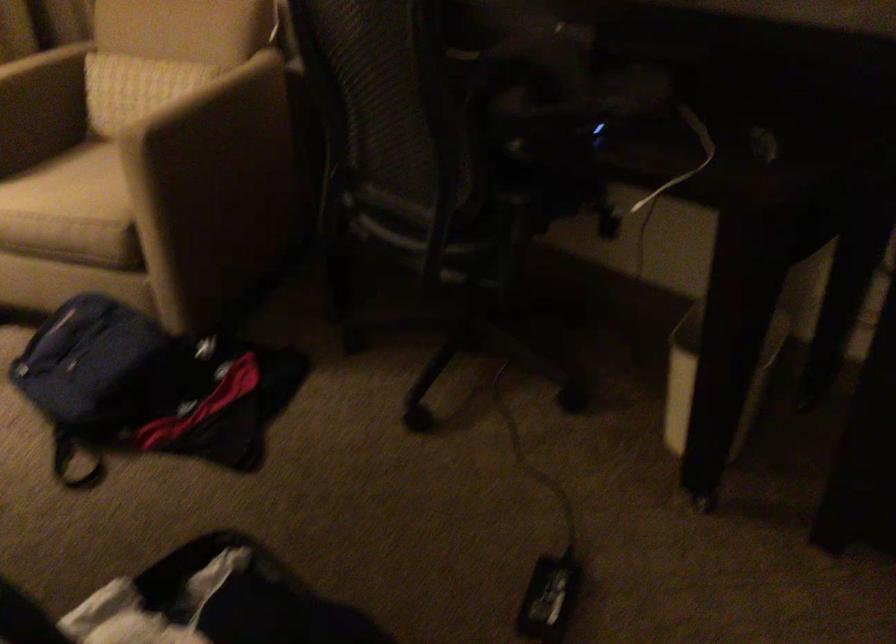
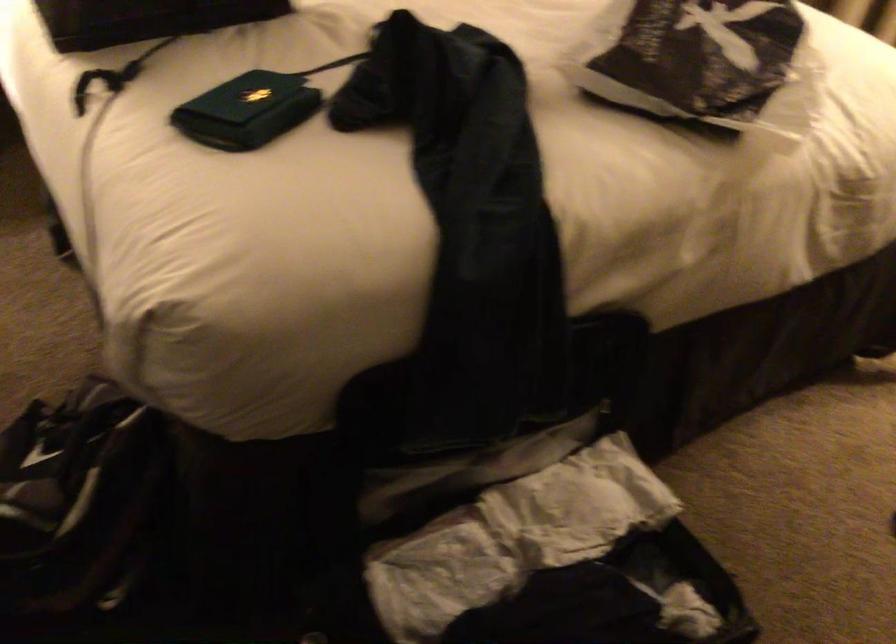
First-person continuous shooting, in which direction is the camera rotating?

The camera rotated toward left-down.